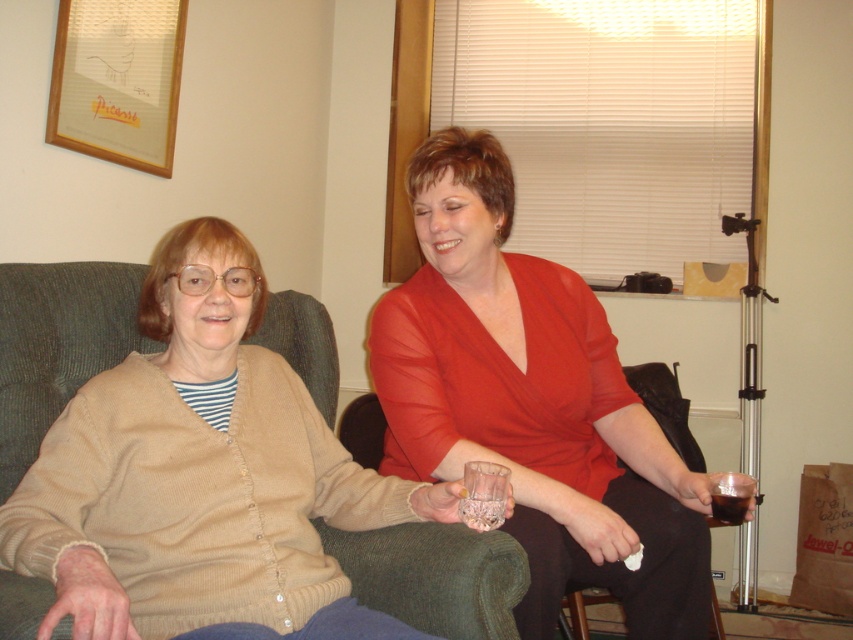
You are trying to place a small plant on the table between the two people in the image. The table has a coordinate system where the center is at point (532, 403). If you want to place the plant exactly at the center of the table, where should you put it?

The center of the table is at point (532, 403), so you should place the plant exactly at that coordinate.

You are a photographer setting up a shoot in the living room. You need to position a new lamp so that it illuminates the matte glass at center without affecting the beige knit cardigan at center. Given their heights, where should you place the lamp relative to the two objects?

The matte glass at center is taller than the beige knit cardigan at center. To illuminate the matte glass without affecting the cardigan, position the lamp above the matte glass so the light shines downward, casting its light specifically on the glass while the cardigan remains in shadow below.

You are setting up a photo shoot in the living room and need to place a large decorative item between the two people. The matte glass at center and the beige knit cardigan at center are both candidates. Which object should you choose to ensure it is bigger and more noticeable?

The matte glass at center is larger than the beige knit cardigan at center, so you should choose the matte glass at center as it will be more noticeable in the photo shoot.